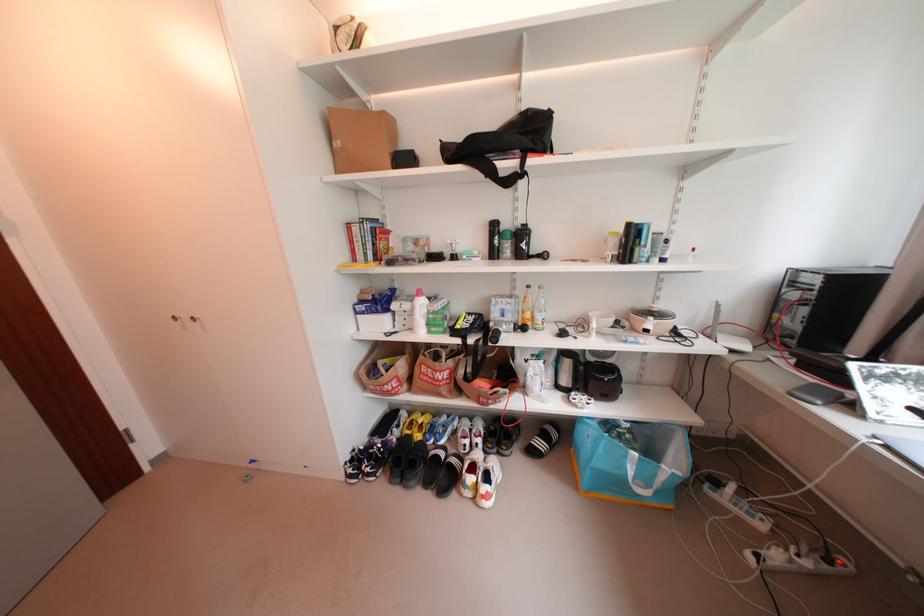
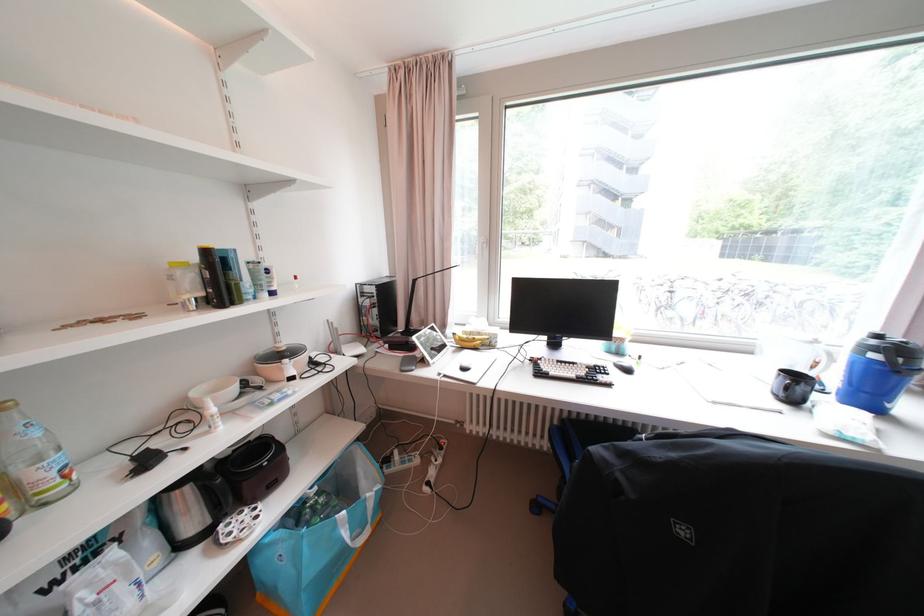
In the second image, find the point that corresponds to the point at 600,315 in the first image.

(202, 395)